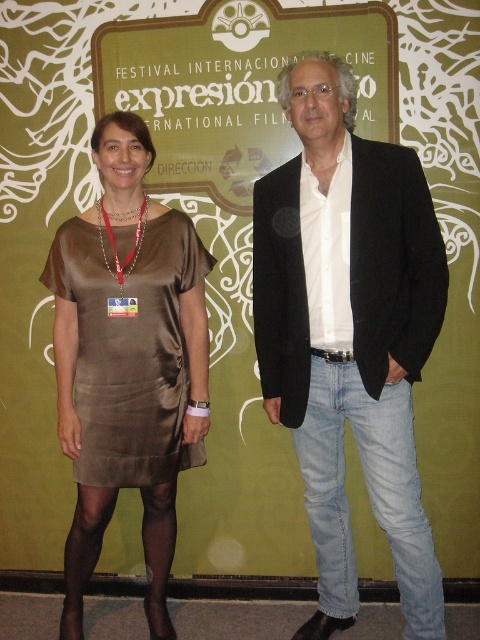
Which is below, black cotton blazer at center or light blue denim jeans at lower right?

Positioned lower is light blue denim jeans at lower right.

Does black cotton blazer at center lie in front of light blue denim jeans at lower right?

Yes, it is.

Where is `black cotton blazer at center`? black cotton blazer at center is located at coordinates (348, 332).

This screenshot has height=640, width=480. What do you see at coordinates (348, 332) in the screenshot? I see `black cotton blazer at center` at bounding box center [348, 332].

Consider the image. Is black cotton blazer at center to the right of satin dress at left from the viewer's perspective?

Answer: Yes, black cotton blazer at center is to the right of satin dress at left.

Does point (388, 532) come closer to viewer compared to point (155, 221)?

That is True.

Find the location of a particular element. black cotton blazer at center is located at coordinates (348, 332).

Between satin dress at left and light blue denim jeans at lower right, which one is positioned lower?

light blue denim jeans at lower right is lower down.

Consider the image. Which of these two, satin dress at left or light blue denim jeans at lower right, stands shorter?

Standing shorter between the two is satin dress at left.

In order to click on satin dress at left in this screenshot , I will do `click(130, 349)`.